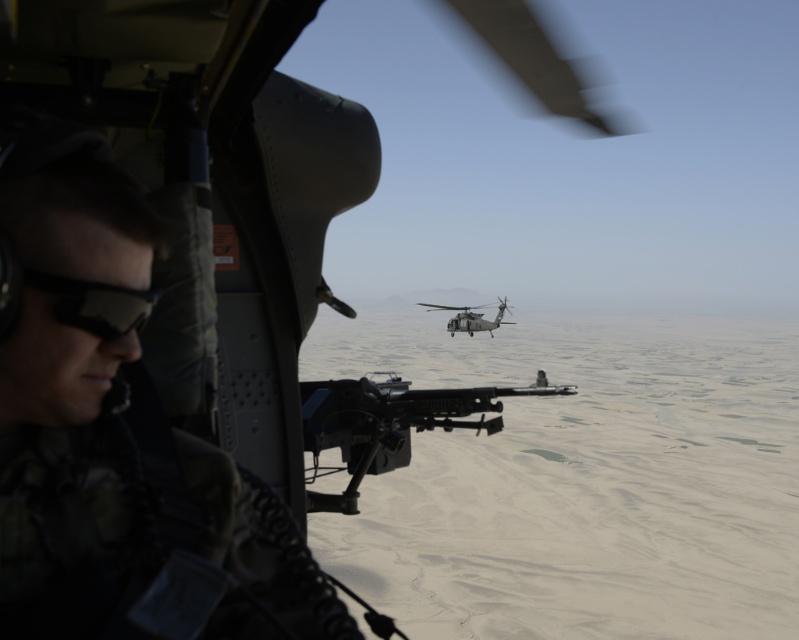
Is camo fabric uniform at left wider than matte black rifle at center?

No, camo fabric uniform at left is not wider than matte black rifle at center.

Describe the element at coordinates (117, 435) in the screenshot. I see `camo fabric uniform at left` at that location.

Between point (26, 600) and point (356, 445), which one is positioned behind?

Point (356, 445)

Find the location of a particular element. This screenshot has height=640, width=799. camo fabric uniform at left is located at coordinates (117, 435).

Is matte black rifle at center in front of black matte goggles at left?

No, matte black rifle at center is further to the viewer.

Based on the photo, does matte black rifle at center come behind black matte goggles at left?

Yes, it is behind black matte goggles at left.

From the picture: Who is more distant from viewer, (352, 419) or (68, 301)?

Point (352, 419)

You are a GUI agent. You are given a task and a screenshot of the screen. Output one action in this format:
    pyautogui.click(x=<x>, y=<y>)
    Task: Click on the matte black rifle at center
    
    Given the screenshot: What is the action you would take?
    pyautogui.click(x=390, y=422)

Which is more to the right, camo fabric uniform at left or dark gray metallic helicopter at center?

Positioned to the right is dark gray metallic helicopter at center.

Does camo fabric uniform at left appear over dark gray metallic helicopter at center?

No, camo fabric uniform at left is not above dark gray metallic helicopter at center.

Is point (100, 566) farther from camera compared to point (475, 320)?

No, (100, 566) is closer to viewer.

Find the location of a particular element. This screenshot has height=640, width=799. camo fabric uniform at left is located at coordinates (117, 435).